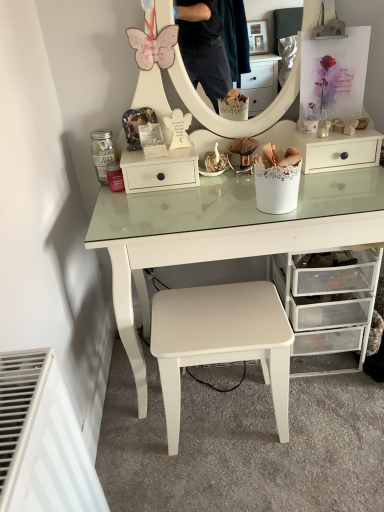
Question: Is white matte drawer at center taller than white matte stool at center?

Choices:
 (A) no
 (B) yes

Answer: (A)

Question: From the image's perspective, is white matte drawer at center beneath white matte stool at center?

Choices:
 (A) no
 (B) yes

Answer: (A)

Question: Can you confirm if white matte drawer at center is positioned to the right of white matte stool at center?

Choices:
 (A) yes
 (B) no

Answer: (B)

Question: Is white matte drawer at center next to white matte stool at center?

Choices:
 (A) no
 (B) yes

Answer: (A)

Question: Does white matte drawer at center have a lesser width compared to white matte stool at center?

Choices:
 (A) no
 (B) yes

Answer: (B)

Question: Considering the relative sizes of white matte drawer at center and white matte stool at center in the image provided, is white matte drawer at center bigger than white matte stool at center?

Choices:
 (A) no
 (B) yes

Answer: (A)

Question: Is clear plastic drawers at lower right directly adjacent to white matte stool at center?

Choices:
 (A) no
 (B) yes

Answer: (A)

Question: Is clear plastic drawers at lower right not within white matte stool at center?

Choices:
 (A) no
 (B) yes

Answer: (B)

Question: Is white matte stool at center at the back of clear plastic drawers at lower right?

Choices:
 (A) yes
 (B) no

Answer: (B)

Question: Considering the relative positions of clear plastic drawers at lower right and white matte stool at center in the image provided, is clear plastic drawers at lower right behind white matte stool at center?

Choices:
 (A) yes
 (B) no

Answer: (A)

Question: Could you tell me if clear plastic drawers at lower right is turned towards white matte stool at center?

Choices:
 (A) no
 (B) yes

Answer: (A)

Question: Is the position of clear plastic drawers at lower right less distant than that of white matte stool at center?

Choices:
 (A) no
 (B) yes

Answer: (A)

Question: Does white matte stool at center have a larger size compared to white matte drawer at center?

Choices:
 (A) yes
 (B) no

Answer: (A)